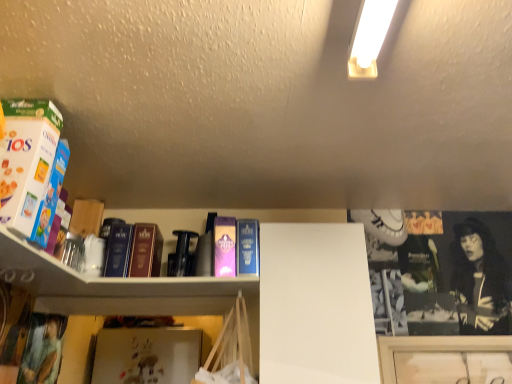
Question: From the image's perspective, is hardcover book at center, which is the first paperback book in right-to-left order, below purple matte paperback book at center, the first paperback book positioned from the left?

Choices:
 (A) yes
 (B) no

Answer: (A)

Question: Could you tell me if hardcover book at center, which is the first paperback book in right-to-left order, is facing purple matte paperback book at center, positioned as the second paperback book in right-to-left order?

Choices:
 (A) yes
 (B) no

Answer: (B)

Question: Can we say hardcover book at center, the second paperback book when ordered from left to right, lies outside purple matte paperback book at center, positioned as the second paperback book in right-to-left order?

Choices:
 (A) yes
 (B) no

Answer: (A)

Question: Is hardcover book at center, the second paperback book when ordered from left to right, further to camera compared to purple matte paperback book at center, positioned as the second paperback book in right-to-left order?

Choices:
 (A) no
 (B) yes

Answer: (B)

Question: Considering the relative sizes of hardcover book at center, which is the first paperback book in right-to-left order, and purple matte paperback book at center, positioned as the second paperback book in right-to-left order, in the image provided, is hardcover book at center, which is the first paperback book in right-to-left order, smaller than purple matte paperback book at center, positioned as the second paperback book in right-to-left order,?

Choices:
 (A) no
 (B) yes

Answer: (B)

Question: Is hardcover book at center, which is the first paperback book in right-to-left order, to the right of purple matte paperback book at center, positioned as the second paperback book in right-to-left order, from the viewer's perspective?

Choices:
 (A) no
 (B) yes

Answer: (B)

Question: Is matte purple book at left, the 3th book when ordered from back to front, behind hardcover book at center, which ranks as the 4th book in front-to-back order?

Choices:
 (A) no
 (B) yes

Answer: (A)

Question: Does matte purple book at left, the 3th book when ordered from back to front, appear on the right side of hardcover book at center, which ranks as the 4th book in front-to-back order?

Choices:
 (A) yes
 (B) no

Answer: (B)

Question: Is matte purple book at left, the 3th book when ordered from back to front, wider than hardcover book at center, which is counted as the 1th book, starting from the back?

Choices:
 (A) no
 (B) yes

Answer: (A)

Question: From the image's perspective, is matte purple book at left, which is the 2th book in front-to-back order, beneath hardcover book at center, which ranks as the 4th book in front-to-back order?

Choices:
 (A) yes
 (B) no

Answer: (B)

Question: From a real-world perspective, does matte purple book at left, the 3th book when ordered from back to front, stand above hardcover book at center, which is counted as the 1th book, starting from the back?

Choices:
 (A) yes
 (B) no

Answer: (B)

Question: Is matte purple book at left, which is the 2th book in front-to-back order, located outside hardcover book at center, which is counted as the 1th book, starting from the back?

Choices:
 (A) yes
 (B) no

Answer: (A)

Question: Is matte purple book at left, the 3th book when ordered from back to front, bigger than hardcover book at center, which is the first paperback book in right-to-left order?

Choices:
 (A) yes
 (B) no

Answer: (B)